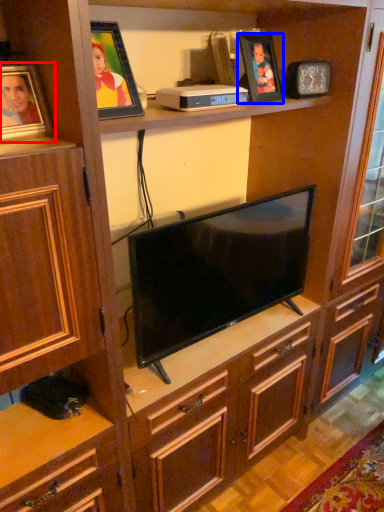
Question: Which object appears closest to the camera in this image, picture frame (highlighted by a red box) or picture frame (highlighted by a blue box)?

Choices:
 (A) picture frame
 (B) picture frame

Answer: (A)